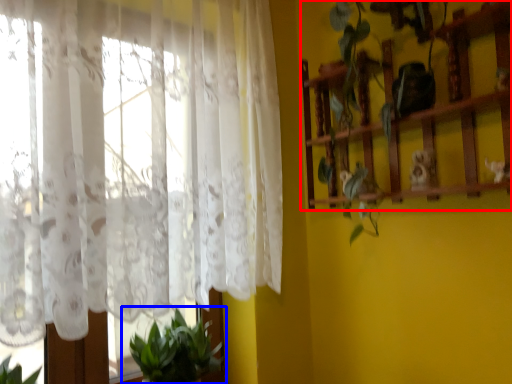
Question: Which of the following is the closest to the observer, shelf (highlighted by a red box) or houseplant (highlighted by a blue box)?

Choices:
 (A) shelf
 (B) houseplant

Answer: (A)